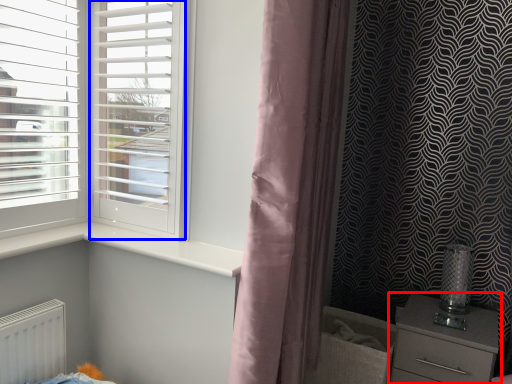
Question: Which of the following is the closest to the observer, chest of drawers (highlighted by a red box) or screen door (highlighted by a blue box)?

Choices:
 (A) chest of drawers
 (B) screen door

Answer: (B)